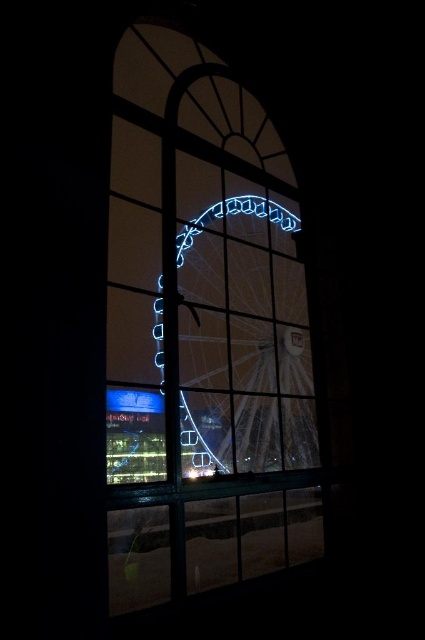
Question: Is clear glass window at center smaller than blue neon ferris wheel at center?

Choices:
 (A) yes
 (B) no

Answer: (B)

Question: Does clear glass window at center appear over blue neon ferris wheel at center?

Choices:
 (A) yes
 (B) no

Answer: (A)

Question: Which object appears farthest from the camera in this image?

Choices:
 (A) blue neon ferris wheel at center
 (B) clear glass window at center

Answer: (A)

Question: Is clear glass window at center below blue neon ferris wheel at center?

Choices:
 (A) no
 (B) yes

Answer: (A)

Question: Among these objects, which one is nearest to the camera?

Choices:
 (A) clear glass window at center
 (B) blue neon ferris wheel at center

Answer: (A)